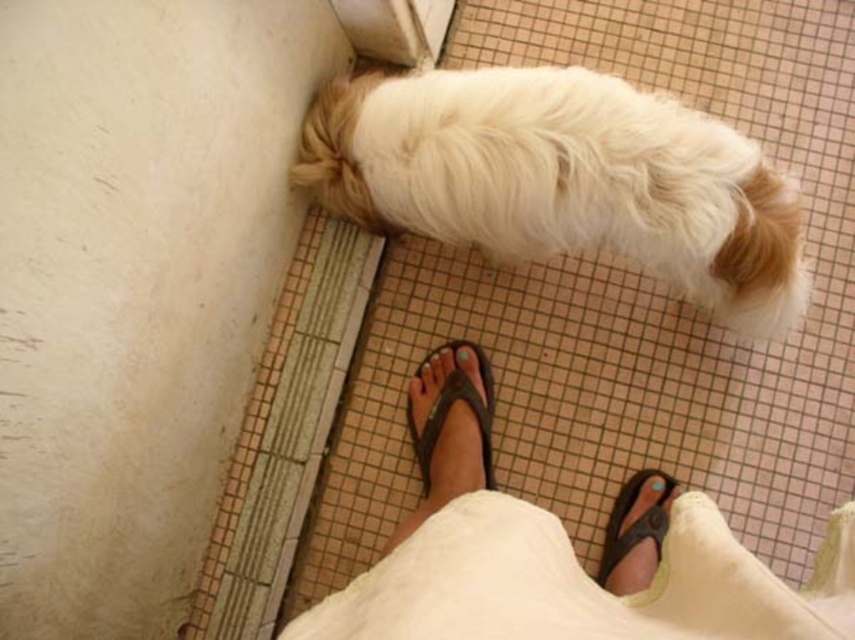
You are looking down at the scene and notice two points marked on the floor. The first point is at coordinate point (762, 289) and the second is at point (447, 392). Which point is closer to you?

Point (762, 289) is closer to the camera than point (447, 392), so the first point is closer to you.